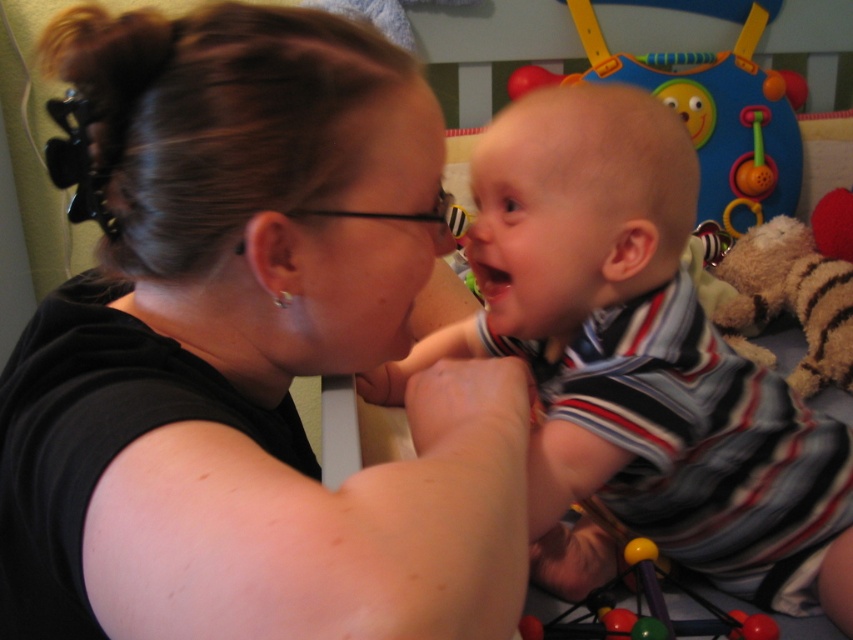
Question: Is rubberized plastic beads at lower center to the right of pink matte mouth at center from the viewer's perspective?

Choices:
 (A) yes
 (B) no

Answer: (A)

Question: Which object appears closest to the camera in this image?

Choices:
 (A) rubberized plastic beads at lower center
 (B) pink matte mouth at center
 (C) striped fabric shirt at center
 (D) plastic colorful activity center at upper center

Answer: (C)

Question: Which object is farther from the camera taking this photo?

Choices:
 (A) black matte shirt at center
 (B) striped fabric shirt at center
 (C) plastic colorful activity center at upper center

Answer: (C)

Question: In this image, where is black matte shirt at center located relative to rubberized plastic beads at lower center?

Choices:
 (A) left
 (B) right

Answer: (A)

Question: Does black matte shirt at center have a greater width compared to rubberized plastic beads at lower center?

Choices:
 (A) no
 (B) yes

Answer: (B)

Question: Estimate the real-world distances between objects in this image. Which object is closer to the striped fabric shirt at center?

Choices:
 (A) plastic colorful activity center at upper center
 (B) pink matte mouth at center
 (C) rubberized plastic beads at lower center
 (D) black matte shirt at center

Answer: (C)